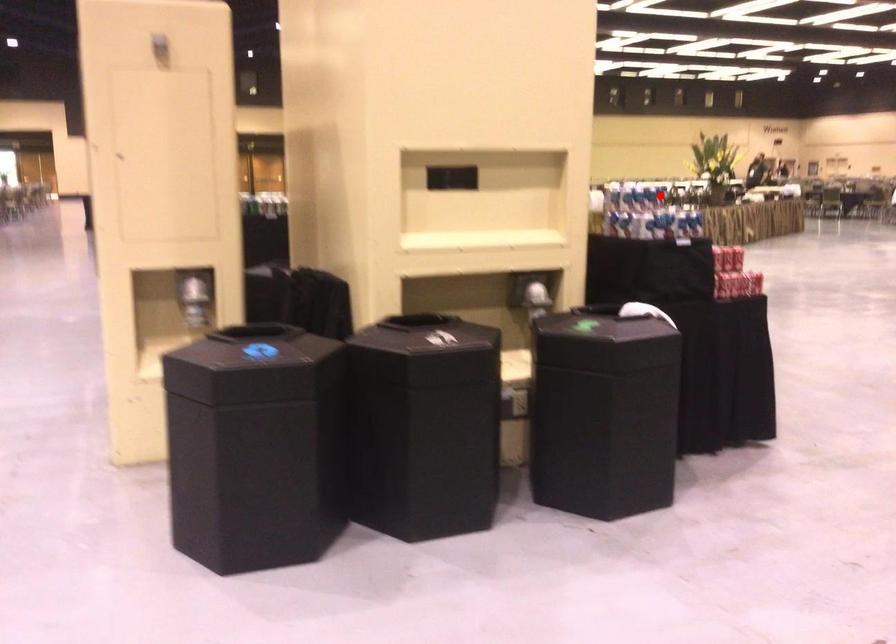
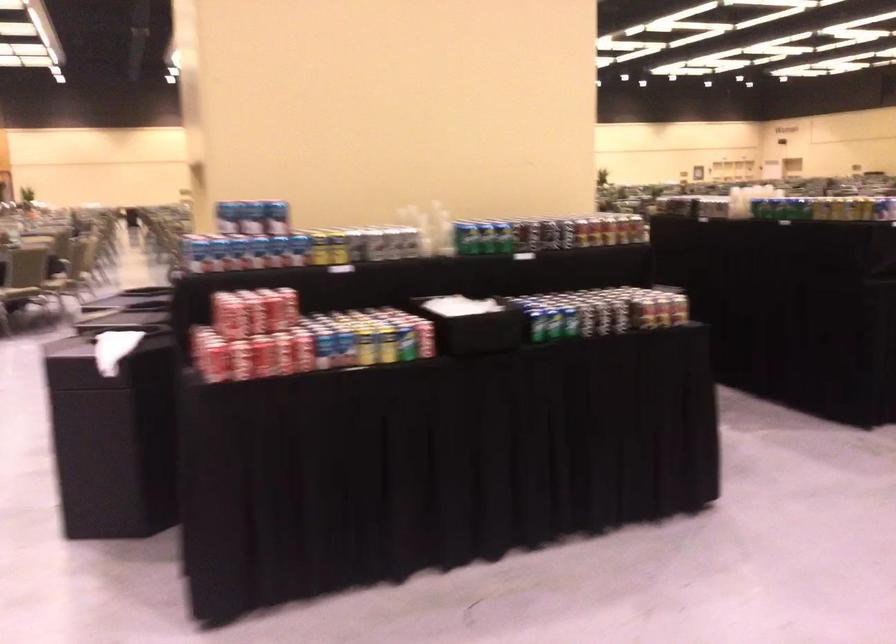
Question: A red point is marked in image1. In image2, is the corresponding 3D point closer to the camera or farther? Reply with the corresponding letter.

Choices:
 (A) The corresponding 3D point is closer.
 (B) The corresponding 3D point is farther.

Answer: (A)